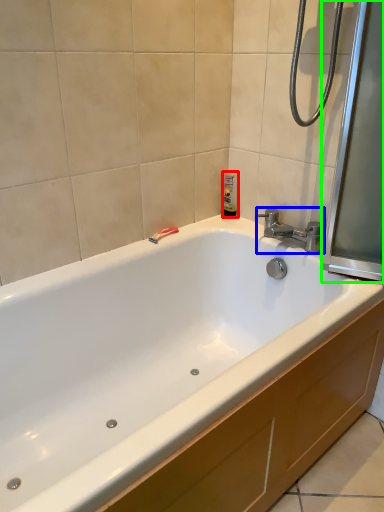
Question: Considering the real-world distances, which object is closest to toiletry (highlighted by a red box)? tap (highlighted by a blue box) or screen door (highlighted by a green box).

Choices:
 (A) tap
 (B) screen door

Answer: (A)